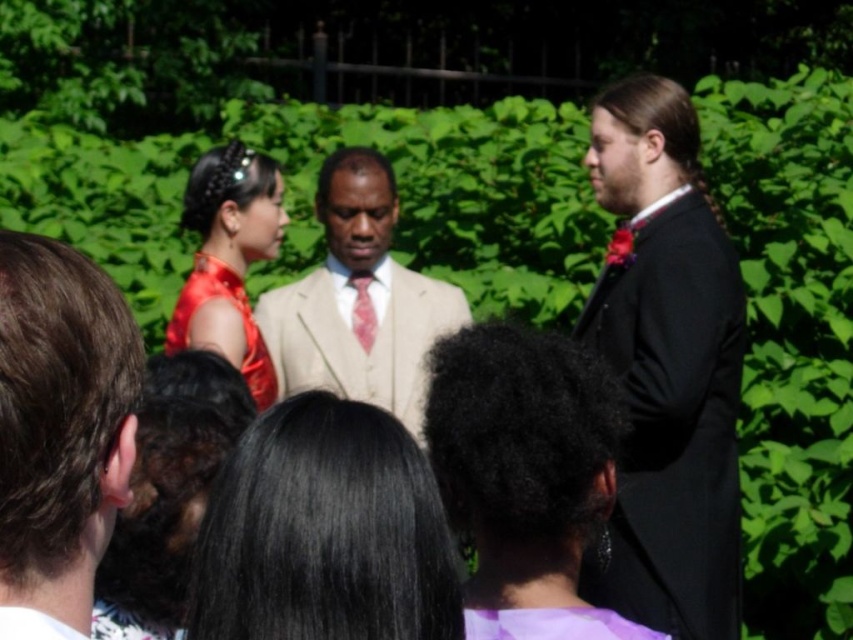
Can you confirm if black satin suit at right is thinner than beige fabric suit at center?

Yes.

Who is shorter, black satin suit at right or beige fabric suit at center?

With less height is beige fabric suit at center.

Where is `black satin suit at right`? The image size is (853, 640). black satin suit at right is located at coordinates (666, 365).

Is black satin suit at right wider than shiny red dress at center?

Yes, black satin suit at right is wider than shiny red dress at center.

Who is more forward, (628, 611) or (264, 388)?

Point (628, 611) is more forward.

Between point (699, 177) and point (267, 168), which one is positioned in front?

Point (699, 177)

Identify the location of black satin suit at right. This screenshot has width=853, height=640. (666, 365).

Who is taller, black satin suit at right or black silky hair at center?

With more height is black satin suit at right.

This screenshot has height=640, width=853. Identify the location of black satin suit at right. (666, 365).

Find the location of a particular element. The image size is (853, 640). black satin suit at right is located at coordinates (666, 365).

Where is `black satin suit at right`? black satin suit at right is located at coordinates (666, 365).